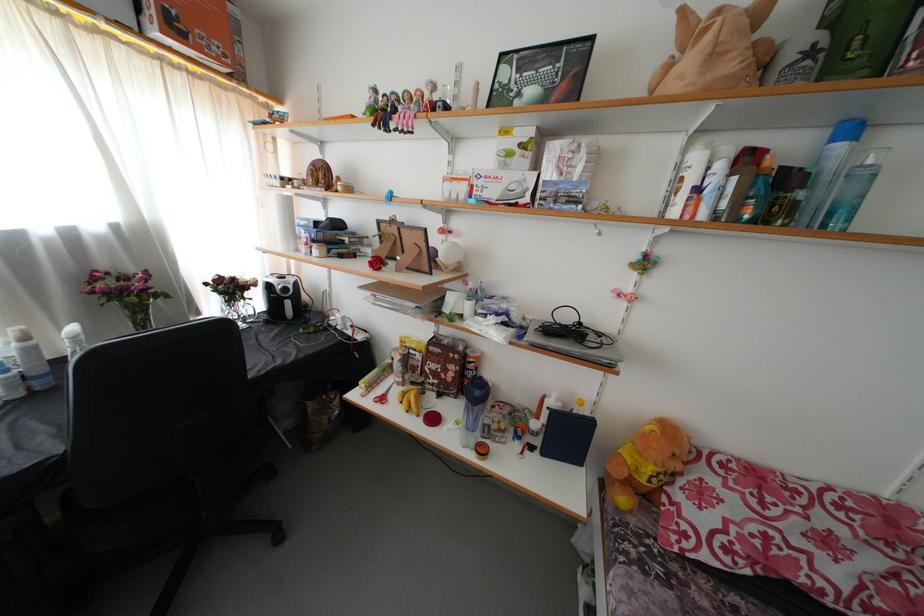
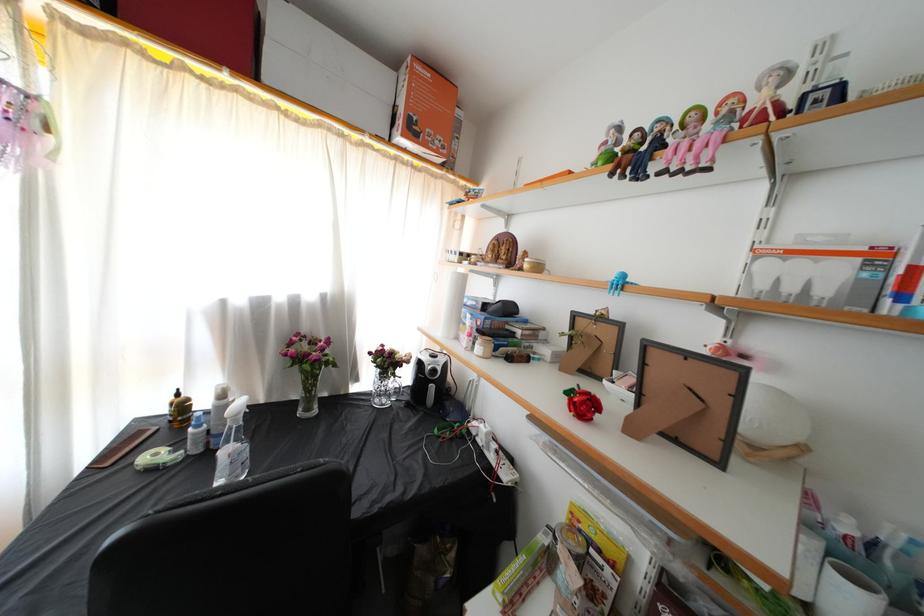
The point at (108, 273) is marked in the first image. Where is the corresponding point in the second image?

(310, 334)